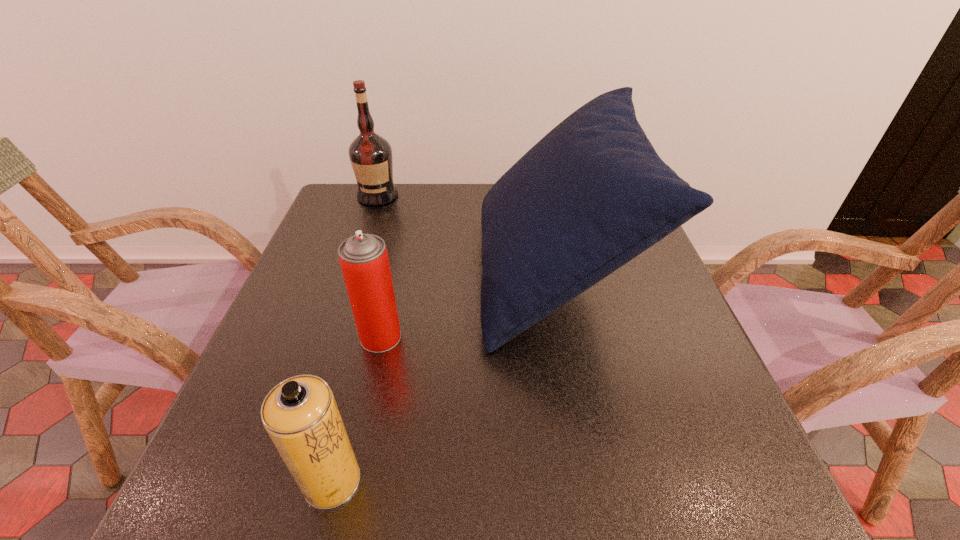
Find the location of a particular element. This screenshot has width=960, height=540. vacant position in the image that satisfies the following two spatial constraints: 1. on the facing side of the rightmost object; 2. on the front side of the nearest object is located at coordinates [x=592, y=481].

What are the coordinates of `free space that satisfies the following two spatial constraints: 1. on the surface of the liquor; 2. on the left side of the nearer aerosol can` in the screenshot? It's located at (282, 481).

Image resolution: width=960 pixels, height=540 pixels. What are the coordinates of `free space in the image that satisfies the following two spatial constraints: 1. on the facing side of the cushion; 2. on the front side of the nearer aerosol can` in the screenshot? It's located at (592, 481).

I want to click on free space that satisfies the following two spatial constraints: 1. on the surface of the farthest object; 2. on the right side of the farther aerosol can, so click(x=330, y=337).

Where is `vacant point that satisfies the following two spatial constraints: 1. on the surface of the farther aerosol can; 2. on the right side of the farthest object`? This screenshot has width=960, height=540. vacant point that satisfies the following two spatial constraints: 1. on the surface of the farther aerosol can; 2. on the right side of the farthest object is located at coordinates (330, 337).